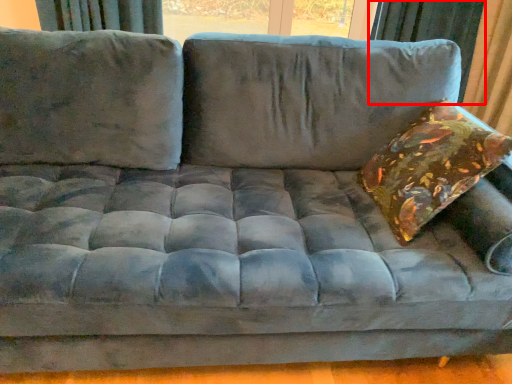
Question: In this image, where is curtain (annotated by the red box) located relative to throw pillow?

Choices:
 (A) right
 (B) left

Answer: (A)